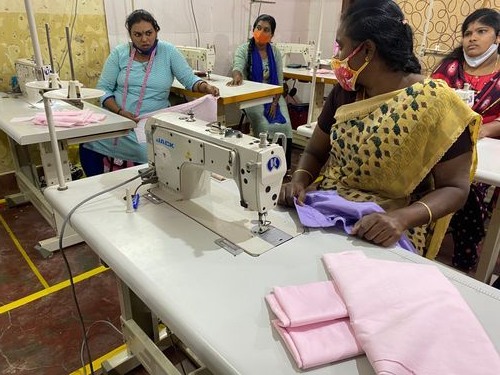
Find the location of a particular element. brown wall on left side is located at coordinates (80, 25), (21, 34).